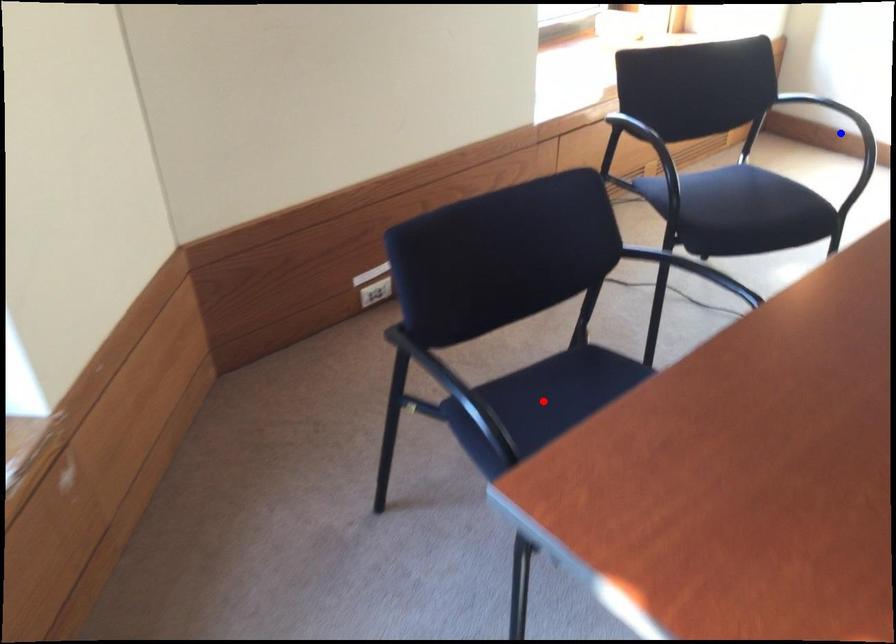
Question: In the image, two points are highlighted. Which point is nearer to the camera? Reply with the corresponding letter.

Choices:
 (A) blue point
 (B) red point

Answer: (B)